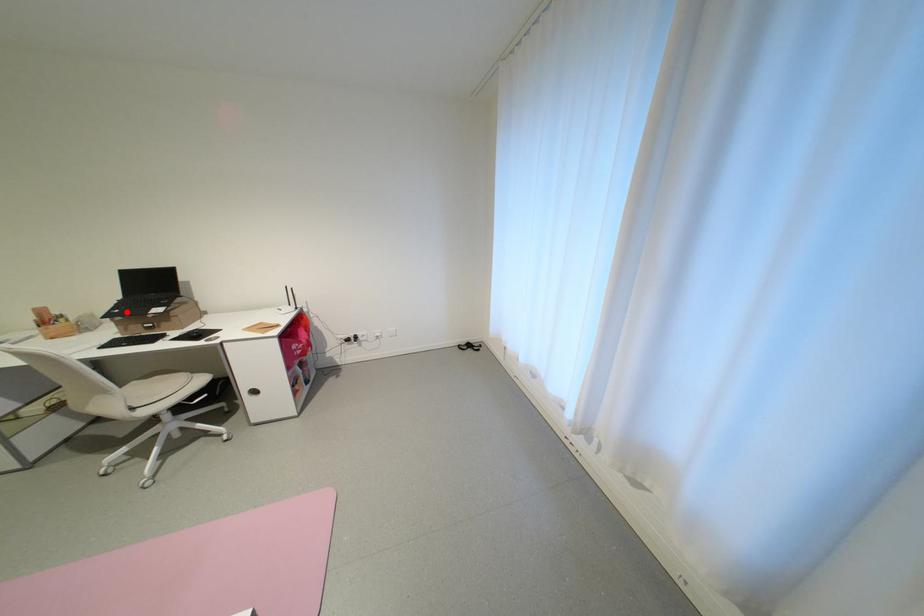
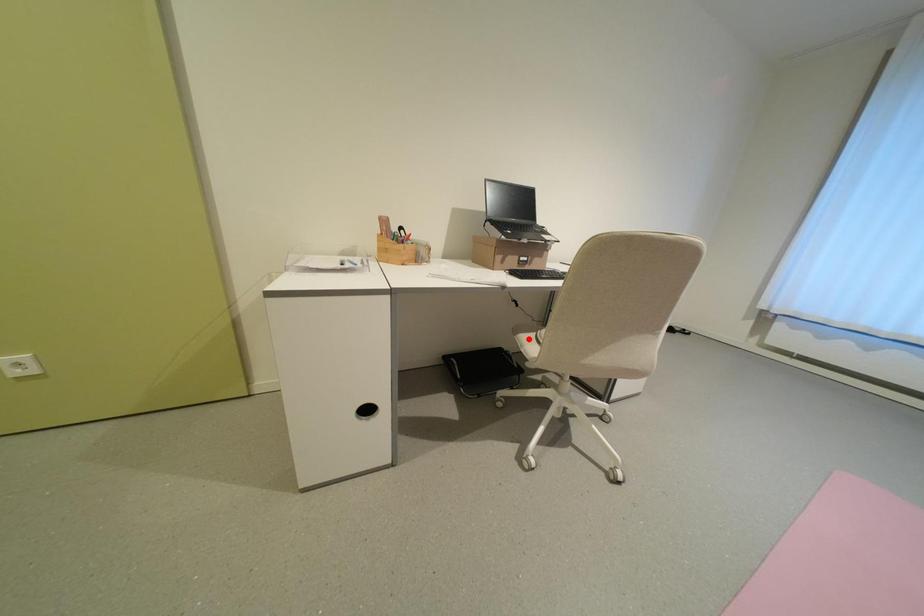
I am providing you with two images of the same scene from different viewpoints. A red point is marked on the first image and another point is marked on the second image. Do the highlighted points in image1 and image2 indicate the same real-world spot?

No